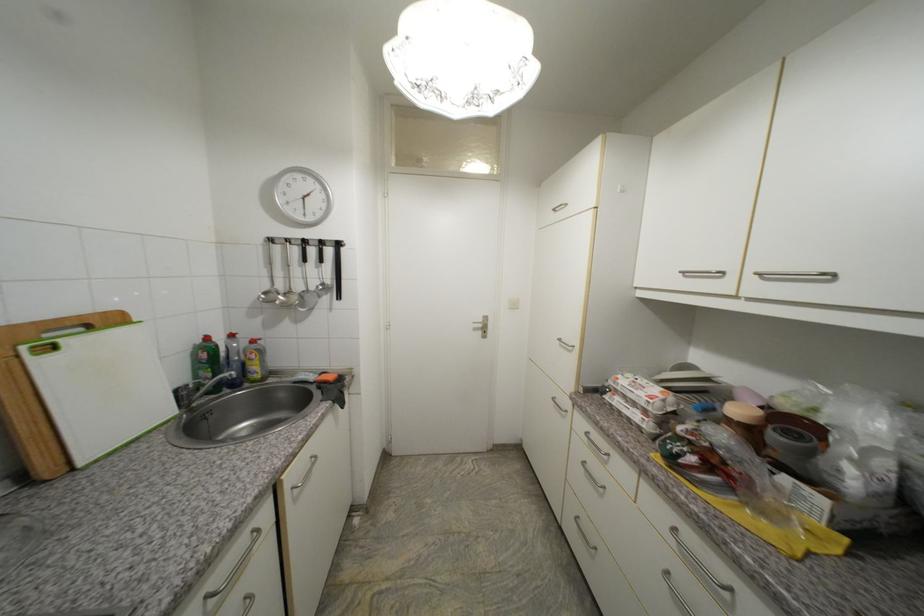
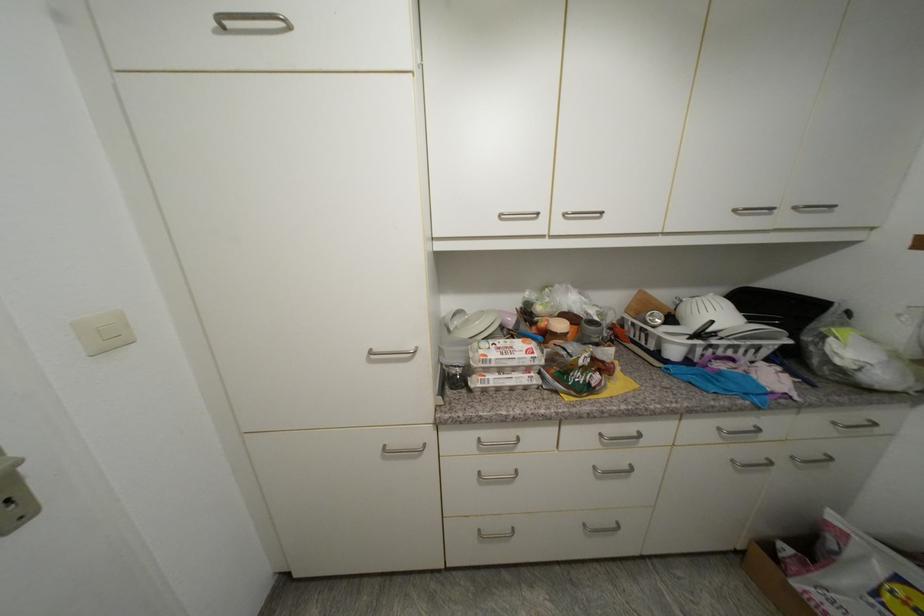
The point at (x=623, y=379) is marked in the first image. Where is the corresponding point in the second image?

(492, 357)